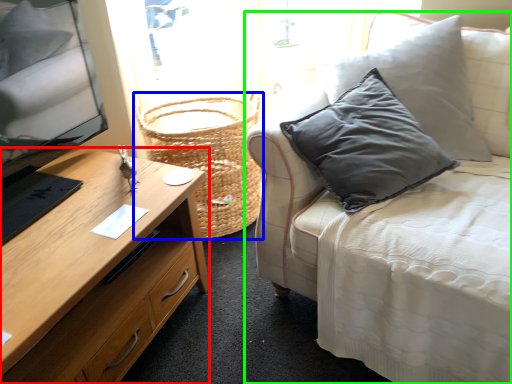
Question: Which is nearer to the desk (highlighted by a red box)? basket (highlighted by a blue box) or studio couch (highlighted by a green box).

Choices:
 (A) basket
 (B) studio couch

Answer: (A)